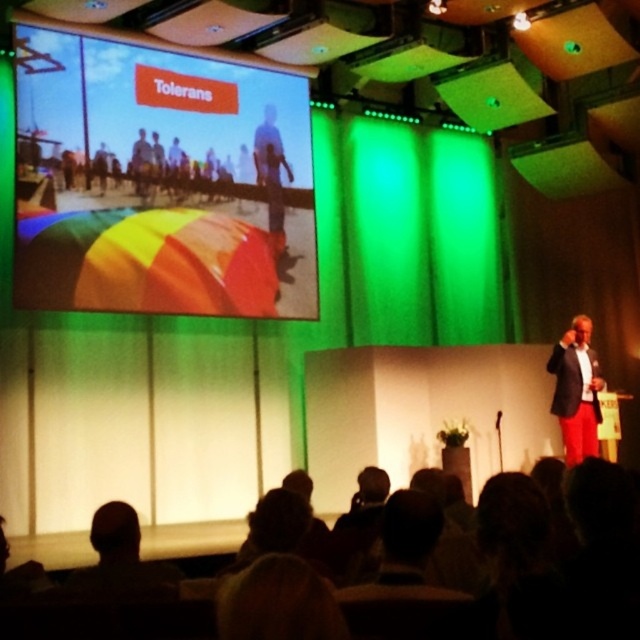
Does point (99, 205) come farther from viewer compared to point (552, 365)?

No, (99, 205) is closer to viewer.

Consider the image. Does rainbow fabric umbrella at upper left appear over matte black suit at right?

Yes.

Locate an element on the screen. Image resolution: width=640 pixels, height=640 pixels. rainbow fabric umbrella at upper left is located at coordinates (160, 180).

Find the location of a particular element. Image resolution: width=640 pixels, height=640 pixels. rainbow fabric umbrella at upper left is located at coordinates (160, 180).